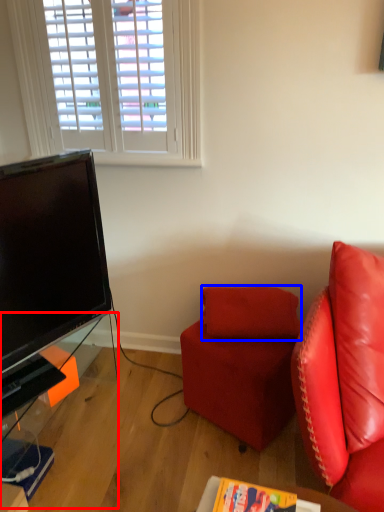
Question: Which object is further to the camera taking this photo, table (highlighted by a red box) or pillow (highlighted by a blue box)?

Choices:
 (A) table
 (B) pillow

Answer: (B)